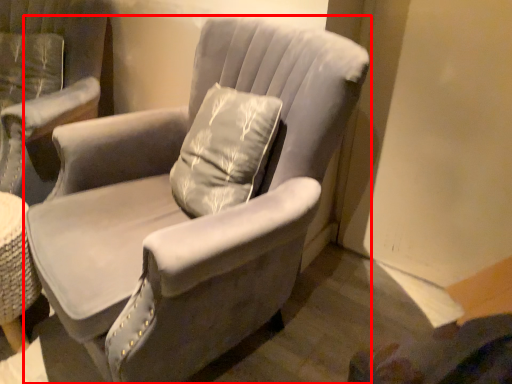
Question: From the image's perspective, what is the correct spatial positioning of chair (annotated by the red box) in reference to chair?

Choices:
 (A) above
 (B) below

Answer: (B)